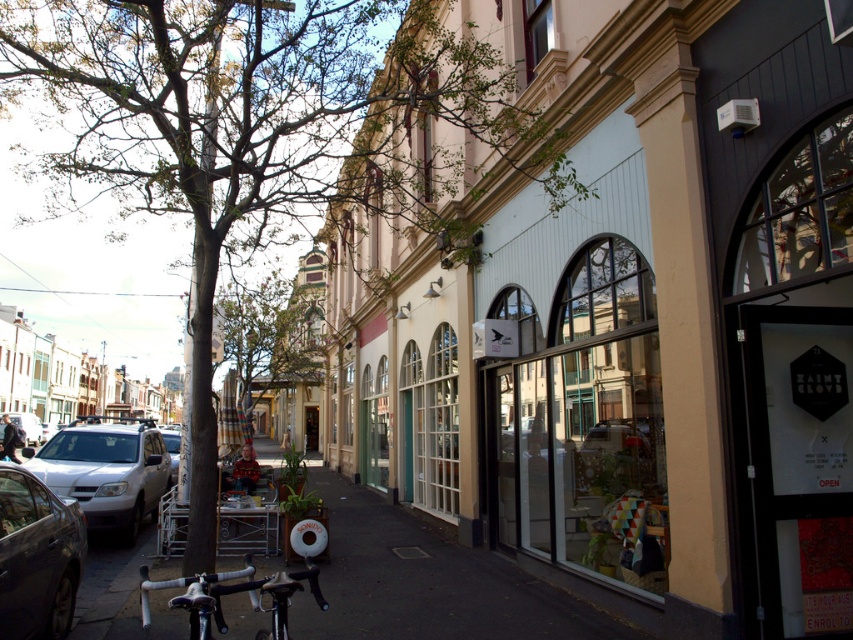
In the scene shown: Who is more distant from viewer, (463, 572) or (170, 480)?

The point (170, 480) is behind.

Which of these two, dark gray asphalt at center or white matte car at center, stands shorter?

dark gray asphalt at center is shorter.

Which is behind, point (544, 634) or point (178, 458)?

Point (178, 458)

What are the coordinates of `dark gray asphalt at center` in the screenshot? It's located at (428, 582).

Which of these two, green leafy tree at center or white matte car at center, stands taller?

Standing taller between the two is green leafy tree at center.

Which of these two, green leafy tree at center or white matte car at center, stands shorter?

white matte car at center

Measure the distance between green leafy tree at center and camera.

green leafy tree at center and camera are 5.60 meters apart.

At what (x,y) coordinates should I click in order to perform the action: click on green leafy tree at center. Please return your answer as a coordinate pair (x, y). Image resolution: width=853 pixels, height=640 pixels. Looking at the image, I should click on (268, 128).

From the picture: Is green leafy tree at center above silver metallic bicycle at lower left?

Yes, green leafy tree at center is above silver metallic bicycle at lower left.

Is point (450, 205) positioned before point (310, 564)?

No, (450, 205) is behind (310, 564).

At what (x,y) coordinates should I click in order to perform the action: click on green leafy tree at center. Please return your answer as a coordinate pair (x, y). This screenshot has width=853, height=640. Looking at the image, I should click on (268, 128).